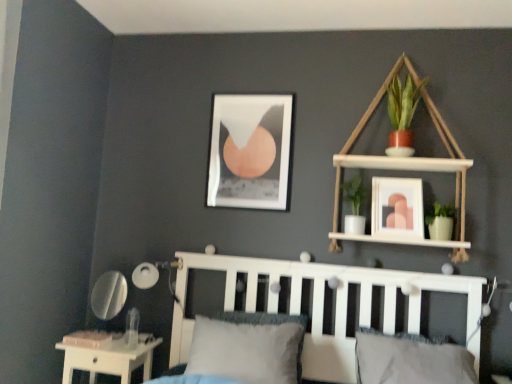
Question: Does white wood bookshelf at upper right have a greater height compared to white wooden bed frame at center?

Choices:
 (A) no
 (B) yes

Answer: (B)

Question: From the image's perspective, is white wood bookshelf at upper right under white wooden bed frame at center?

Choices:
 (A) no
 (B) yes

Answer: (A)

Question: Is white wood bookshelf at upper right in contact with white wooden bed frame at center?

Choices:
 (A) no
 (B) yes

Answer: (A)

Question: Is white wood bookshelf at upper right not near white wooden bed frame at center?

Choices:
 (A) yes
 (B) no

Answer: (B)

Question: Considering the relative sizes of white wood bookshelf at upper right and white wooden bed frame at center in the image provided, is white wood bookshelf at upper right thinner than white wooden bed frame at center?

Choices:
 (A) no
 (B) yes

Answer: (B)

Question: Looking at their shapes, would you say white wooden bed frame at center is wider or thinner than matte black picture frame at upper center, arranged as the first picture frame when viewed from the left?

Choices:
 (A) wide
 (B) thin

Answer: (A)

Question: Looking at the image, does white wooden bed frame at center seem bigger or smaller compared to matte black picture frame at upper center, the second picture frame positioned from the front?

Choices:
 (A) big
 (B) small

Answer: (A)

Question: Visually, is white wooden bed frame at center positioned to the left or to the right of matte black picture frame at upper center, which ranks as the second picture frame in right-to-left order?

Choices:
 (A) left
 (B) right

Answer: (B)

Question: In terms of height, does white wooden bed frame at center look taller or shorter compared to matte black picture frame at upper center, which ranks as the second picture frame in right-to-left order?

Choices:
 (A) short
 (B) tall

Answer: (B)

Question: Is white glossy table at lower left situated inside white matte lamp at lower left or outside?

Choices:
 (A) outside
 (B) inside

Answer: (A)

Question: Would you say white glossy table at lower left is to the left or to the right of white matte lamp at lower left in the picture?

Choices:
 (A) right
 (B) left

Answer: (B)

Question: Is point (142, 347) positioned closer to the camera than point (170, 263)?

Choices:
 (A) closer
 (B) farther

Answer: (A)

Question: Considering the positions of white glossy table at lower left and white matte lamp at lower left in the image, is white glossy table at lower left bigger or smaller than white matte lamp at lower left?

Choices:
 (A) small
 (B) big

Answer: (B)

Question: In terms of size, does gray fabric pillow at lower center, marked as the 1th pillow in a right-to-left arrangement, appear bigger or smaller than white matte lamp at lower left?

Choices:
 (A) small
 (B) big

Answer: (B)

Question: From the image's perspective, is gray fabric pillow at lower center, marked as the 1th pillow in a right-to-left arrangement, located above or below white matte lamp at lower left?

Choices:
 (A) above
 (B) below

Answer: (B)